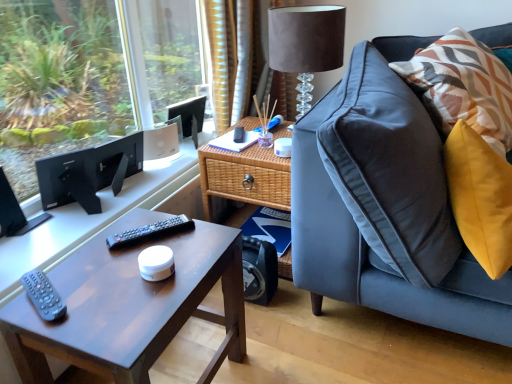
This screenshot has height=384, width=512. Find the location of `free space in front of black plastic remote at center, which appears as the 1th remote when viewed from the right`. free space in front of black plastic remote at center, which appears as the 1th remote when viewed from the right is located at coordinates (130, 280).